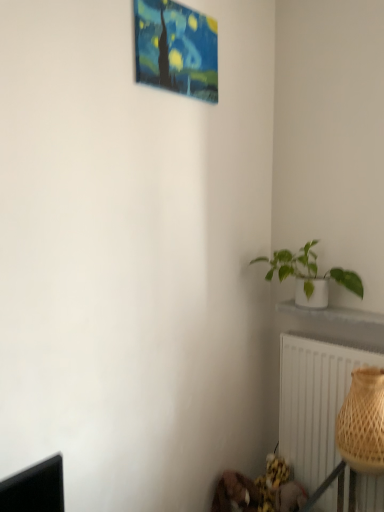
In order to click on white ceramic plant pot at lower right in this screenshot , I will do `click(331, 314)`.

Measure the distance between point (285,395) and camera.

A distance of 1.87 meters exists between point (285,395) and camera.

Locate an element on the screen. The width and height of the screenshot is (384, 512). painted canvas painting at upper center is located at coordinates (176, 49).

Between brown woven basket at lower right and painted canvas painting at upper center, which one has smaller size?

painted canvas painting at upper center.

Is brown woven basket at lower right not within painted canvas painting at upper center?

Indeed, brown woven basket at lower right is completely outside painted canvas painting at upper center.

Is brown woven basket at lower right oriented towards painted canvas painting at upper center?

No, brown woven basket at lower right is not aimed at painted canvas painting at upper center.

Considering the sizes of objects brown woven basket at lower right and painted canvas painting at upper center in the image provided, who is shorter, brown woven basket at lower right or painted canvas painting at upper center?

painted canvas painting at upper center.

Considering the sizes of objects brown woven basket at lower right and white textured radiator at lower right in the image provided, who is shorter, brown woven basket at lower right or white textured radiator at lower right?

Standing shorter between the two is brown woven basket at lower right.

Is brown woven basket at lower right not within white textured radiator at lower right?

Yes.

In the scene shown: Is brown woven basket at lower right not close to white textured radiator at lower right?

No, brown woven basket at lower right is not far away from white textured radiator at lower right.

Locate an element on the screen. basket in front of the white textured radiator at lower right is located at coordinates (363, 422).

From the image's perspective, is white textured radiator at lower right over white ceramic plant pot at lower right?

No, from the image's perspective, white textured radiator at lower right is not over white ceramic plant pot at lower right.

Would you consider white textured radiator at lower right to be distant from white ceramic plant pot at lower right?

Actually, white textured radiator at lower right and white ceramic plant pot at lower right are a little close together.

Which is behind, white textured radiator at lower right or white ceramic plant pot at lower right?

white textured radiator at lower right is behind.

Is brown woven basket at lower right spatially inside white ceramic plant pot at lower right, or outside of it?

brown woven basket at lower right is not inside white ceramic plant pot at lower right, it's outside.

From a real-world perspective, which object rests below the other?

brown woven basket at lower right.

Is brown woven basket at lower right placed right next to white ceramic plant pot at lower right?

No, brown woven basket at lower right is not beside white ceramic plant pot at lower right.

Considering the sizes of objects white ceramic plant pot at lower right and white textured radiator at lower right in the image provided, who is smaller, white ceramic plant pot at lower right or white textured radiator at lower right?

white ceramic plant pot at lower right.

Find the location of `window sill above the white textured radiator at lower right (from a real-world perspective)`. window sill above the white textured radiator at lower right (from a real-world perspective) is located at coordinates (331, 314).

Between point (293, 311) and point (321, 468), which one is positioned in front?

The point (321, 468) is more forward.

Between white ceramic plant pot at lower right and white textured radiator at lower right, which one has more height?

With more height is white textured radiator at lower right.

From the picture: Considering the sizes of objects white matte pot at right and white textured radiator at lower right in the image provided, who is bigger, white matte pot at right or white textured radiator at lower right?

white textured radiator at lower right is bigger.

Is white matte pot at right outside of white textured radiator at lower right?

That's correct, white matte pot at right is outside of white textured radiator at lower right.

Considering the positions of objects white matte pot at right and white textured radiator at lower right in the image provided, who is in front, white matte pot at right or white textured radiator at lower right?

white matte pot at right is closer to the camera.

Considering the positions of objects white matte pot at right and white textured radiator at lower right in the image provided, who is more to the left, white matte pot at right or white textured radiator at lower right?

From the viewer's perspective, white matte pot at right appears more on the left side.

Can you confirm if brown woven basket at lower right is bigger than white matte pot at right?

No.

Is point (342, 453) closer or farther from the camera than point (312, 244)?

Point (342, 453) appears to be closer to the viewer than point (312, 244).

From their relative heights in the image, would you say brown woven basket at lower right is taller or shorter than white matte pot at right?

brown woven basket at lower right is taller than white matte pot at right.

Which of these two, brown woven basket at lower right or white matte pot at right, is wider?

brown woven basket at lower right is wider.

This screenshot has width=384, height=512. In the image, there is a brown woven basket at lower right. Find the location of `picture frame above it (from the image's perspective)`. picture frame above it (from the image's perspective) is located at coordinates (176, 49).

This screenshot has width=384, height=512. I want to click on radiator that appears below the brown woven basket at lower right (from a real-world perspective), so click(x=314, y=401).

Looking at the image, which one is located closer to white matte pot at right, painted canvas painting at upper center or white ceramic plant pot at lower right?

white ceramic plant pot at lower right.

Looking at the image, which one is located closer to brown woven basket at lower right, painted canvas painting at upper center or white textured radiator at lower right?

The object closer to brown woven basket at lower right is white textured radiator at lower right.

Considering their positions, is white textured radiator at lower right positioned closer to white matte pot at right than painted canvas painting at upper center?

white textured radiator at lower right is positioned closer to the anchor white matte pot at right.

Looking at the image, which one is located further to white textured radiator at lower right, painted canvas painting at upper center or white matte pot at right?

painted canvas painting at upper center.

Which object lies further to the anchor point white textured radiator at lower right, white ceramic plant pot at lower right or brown woven basket at lower right?

Among the two, white ceramic plant pot at lower right is located further to white textured radiator at lower right.

When comparing their distances from white ceramic plant pot at lower right, does painted canvas painting at upper center or brown woven basket at lower right seem closer?

brown woven basket at lower right lies closer to white ceramic plant pot at lower right than the other object.

Which object lies further to the anchor point white ceramic plant pot at lower right, brown woven basket at lower right or painted canvas painting at upper center?

painted canvas painting at upper center is further to white ceramic plant pot at lower right.

Looking at the image, which one is located closer to brown woven basket at lower right, white ceramic plant pot at lower right or painted canvas painting at upper center?

white ceramic plant pot at lower right is closer to brown woven basket at lower right.

I want to click on basket between white matte pot at right and white textured radiator at lower right vertically, so click(363, 422).

Image resolution: width=384 pixels, height=512 pixels. Identify the location of basket between painted canvas painting at upper center and white textured radiator at lower right from top to bottom. (363, 422).

Where is `window sill between white matte pot at right and brown woven basket at lower right vertically`? window sill between white matte pot at right and brown woven basket at lower right vertically is located at coordinates (331, 314).

Locate an element on the screen. The width and height of the screenshot is (384, 512). houseplant between painted canvas painting at upper center and white ceramic plant pot at lower right in the vertical direction is located at coordinates (309, 274).